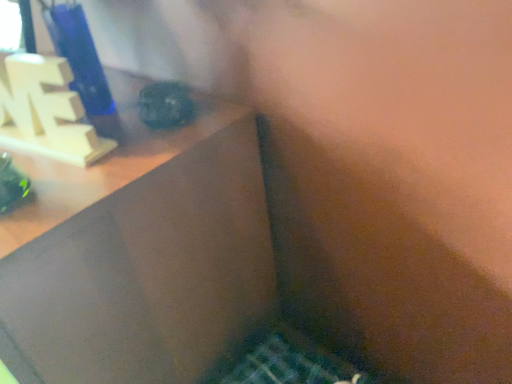
Describe the element at coordinates (46, 112) in the screenshot. I see `wooden letter at upper left` at that location.

This screenshot has width=512, height=384. I want to click on wooden letter at upper left, so click(x=46, y=112).

What is the approximate height of wooden letter at upper left?

It is 6.27 inches.

Find the location of a particular element. wooden letter at upper left is located at coordinates (46, 112).